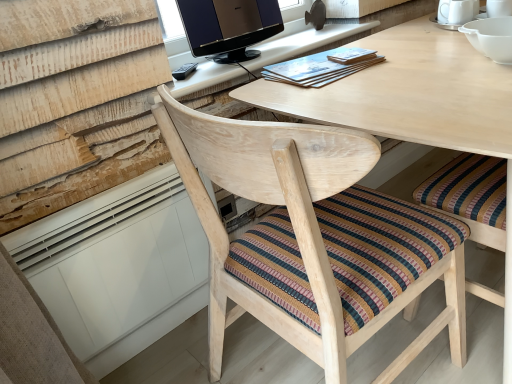
At what (x,y) coordinates should I click in order to perform the action: click on light wood computer desk at upper center. Please return your answer as a coordinate pair (x, y). Looking at the image, I should click on (303, 43).

This screenshot has width=512, height=384. What do you see at coordinates (314, 238) in the screenshot? I see `natural wood chair at center` at bounding box center [314, 238].

Describe the element at coordinates (318, 68) in the screenshot. This screenshot has height=384, width=512. I see `matte wooden book at upper center, the 1th book when ordered from left to right` at that location.

You are a GUI agent. You are given a task and a screenshot of the screen. Output one action in this format:
    pyautogui.click(x=<x>, y=<y>)
    Task: Click on the satin black monitor at upper center
    Image resolution: width=512 pixels, height=384 pixels.
    Given the screenshot: What is the action you would take?
    pyautogui.click(x=229, y=27)

Describe the element at coordinates (351, 55) in the screenshot. The image size is (512, 384). I see `matte brown book at upper center, the first book positioned from the right` at that location.

Image resolution: width=512 pixels, height=384 pixels. In order to click on light wood computer desk at upper center in this screenshot , I will do `click(303, 43)`.

Measure the distance between matte wooden book at upper center, the 1th book when ordered from left to right, and matte brown book at upper center, the 2th book from the left.

matte wooden book at upper center, the 1th book when ordered from left to right, is 3.50 inches away from matte brown book at upper center, the 2th book from the left.

What's the angular difference between matte wooden book at upper center, the 2th book in the right-to-left sequence, and matte brown book at upper center, the 2th book from the left,'s facing directions?

The angle between the facing direction of matte wooden book at upper center, the 2th book in the right-to-left sequence, and the facing direction of matte brown book at upper center, the 2th book from the left, is 1.3 degrees.

Who is smaller, matte wooden book at upper center, the 2th book in the right-to-left sequence, or matte brown book at upper center, the first book positioned from the right?

Smaller between the two is matte brown book at upper center, the first book positioned from the right.

Locate an element on the screen. Image resolution: width=512 pixels, height=384 pixels. book behind the matte wooden book at upper center, the 1th book when ordered from left to right is located at coordinates (351, 55).

Is light wood computer desk at upper center surrounding matte brown book at upper center, the 2th book from the left?

Definitely not — matte brown book at upper center, the 2th book from the left, is not inside light wood computer desk at upper center.

Is matte brown book at upper center, the first book positioned from the right, at the back of light wood computer desk at upper center?

light wood computer desk at upper center does not have its back to matte brown book at upper center, the first book positioned from the right.

Is light wood computer desk at upper center not near matte brown book at upper center, the first book positioned from the right?

That's not correct — light wood computer desk at upper center is a little close to matte brown book at upper center, the first book positioned from the right.

You are a GUI agent. You are given a task and a screenshot of the screen. Output one action in this format:
    pyautogui.click(x=<x>, y=<y>)
    Task: Click on the 2nd book located above the light wood computer desk at upper center (from a real-world perspective)
    The height and width of the screenshot is (384, 512).
    Given the screenshot: What is the action you would take?
    pyautogui.click(x=351, y=55)

Would you say light wood computer desk at upper center is a long distance from natural wood chair at center?

That's not correct — light wood computer desk at upper center is a little close to natural wood chair at center.

From a real-world perspective, who is located lower, light wood computer desk at upper center or natural wood chair at center?

In real-world perspective, natural wood chair at center is lower.

From the picture: How different are the orientations of light wood computer desk at upper center and natural wood chair at center in degrees?

The angular difference between light wood computer desk at upper center and natural wood chair at center is 88.5 degrees.

Is the position of light wood computer desk at upper center more distant than that of natural wood chair at center?

Yes, the depth of light wood computer desk at upper center is greater than that of natural wood chair at center.

From the image's perspective, is light wood computer desk at upper center on top of satin black monitor at upper center?

No, from the image's perspective, light wood computer desk at upper center is not over satin black monitor at upper center.

Which of these two, light wood computer desk at upper center or satin black monitor at upper center, is bigger?

Bigger between the two is light wood computer desk at upper center.

Considering the sizes of objects light wood computer desk at upper center and satin black monitor at upper center in the image provided, who is wider, light wood computer desk at upper center or satin black monitor at upper center?

light wood computer desk at upper center.

Which is closer, (340,26) or (275,21)?

Point (340,26).

Which object is thinner, satin black monitor at upper center or matte wooden book at upper center, the 2th book in the right-to-left sequence?

satin black monitor at upper center is thinner.

Can you confirm if satin black monitor at upper center is smaller than matte wooden book at upper center, the 2th book in the right-to-left sequence?

No, satin black monitor at upper center is not smaller than matte wooden book at upper center, the 2th book in the right-to-left sequence.

How many degrees apart are the facing directions of satin black monitor at upper center and matte wooden book at upper center, the 1th book when ordered from left to right?

The facing directions of satin black monitor at upper center and matte wooden book at upper center, the 1th book when ordered from left to right, are 9.13 degrees apart.

The image size is (512, 384). Find the location of `television above the matte wooden book at upper center, the 1th book when ordered from left to right (from the image's perspective)`. television above the matte wooden book at upper center, the 1th book when ordered from left to right (from the image's perspective) is located at coordinates (229, 27).

Considering the positions of points (330, 56) and (311, 63), is point (330, 56) farther from camera compared to point (311, 63)?

Yes, it is behind point (311, 63).

From the image's perspective, relative to matte wooden book at upper center, the 1th book when ordered from left to right, is matte brown book at upper center, the first book positioned from the right, above or below?

matte brown book at upper center, the first book positioned from the right, is situated higher than matte wooden book at upper center, the 1th book when ordered from left to right, in the image.

Could you tell me if matte brown book at upper center, the first book positioned from the right, is facing matte wooden book at upper center, the 1th book when ordered from left to right?

No, matte brown book at upper center, the first book positioned from the right, does not turn towards matte wooden book at upper center, the 1th book when ordered from left to right.

Can you confirm if matte brown book at upper center, the 2th book from the left, is positioned to the right of matte wooden book at upper center, the 1th book when ordered from left to right?

Yes.

Between matte wooden book at upper center, the 2th book in the right-to-left sequence, and satin black monitor at upper center, which one has less height?

matte wooden book at upper center, the 2th book in the right-to-left sequence.

From the image's perspective, is matte wooden book at upper center, the 1th book when ordered from left to right, under satin black monitor at upper center?

Yes, from the image's perspective, matte wooden book at upper center, the 1th book when ordered from left to right, is beneath satin black monitor at upper center.

Which of these two, matte wooden book at upper center, the 2th book in the right-to-left sequence, or satin black monitor at upper center, is smaller?

With smaller size is matte wooden book at upper center, the 2th book in the right-to-left sequence.

Identify the location of book below the matte brown book at upper center, the 2th book from the left (from a real-world perspective). (318, 68).

I want to click on book behind the light wood computer desk at upper center, so click(x=351, y=55).

From the image, which object appears to be farther from satin black monitor at upper center, light wood computer desk at upper center or matte wooden book at upper center, the 2th book in the right-to-left sequence?

matte wooden book at upper center, the 2th book in the right-to-left sequence, is positioned further to the anchor satin black monitor at upper center.

Looking at the image, which one is located further to light wood computer desk at upper center, matte brown book at upper center, the first book positioned from the right, or matte wooden book at upper center, the 2th book in the right-to-left sequence?

matte brown book at upper center, the first book positioned from the right, is further to light wood computer desk at upper center.

Looking at the image, which one is located closer to light wood computer desk at upper center, matte wooden book at upper center, the 2th book in the right-to-left sequence, or satin black monitor at upper center?

The object closer to light wood computer desk at upper center is satin black monitor at upper center.

From the image, which object appears to be nearer to satin black monitor at upper center, light wood computer desk at upper center or natural wood chair at center?

Among the two, light wood computer desk at upper center is located nearer to satin black monitor at upper center.

Considering their positions, is satin black monitor at upper center positioned closer to natural wood chair at center than light wood computer desk at upper center?

The object closer to natural wood chair at center is light wood computer desk at upper center.

From the image, which object appears to be farther from matte wooden book at upper center, the 1th book when ordered from left to right, light wood computer desk at upper center or natural wood chair at center?

natural wood chair at center.

Based on their spatial positions, is matte brown book at upper center, the 2th book from the left, or matte wooden book at upper center, the 1th book when ordered from left to right, further from satin black monitor at upper center?

matte brown book at upper center, the 2th book from the left, lies further to satin black monitor at upper center than the other object.

Based on the photo, based on their spatial positions, is natural wood chair at center or satin black monitor at upper center closer to matte brown book at upper center, the first book positioned from the right?

satin black monitor at upper center.

Where is `book positioned between natural wood chair at center and light wood computer desk at upper center from near to far`? The width and height of the screenshot is (512, 384). book positioned between natural wood chair at center and light wood computer desk at upper center from near to far is located at coordinates (318, 68).

Find the location of a particular element. book between satin black monitor at upper center and matte brown book at upper center, the 2th book from the left, from left to right is located at coordinates (318, 68).

Identify the location of computer desk between natural wood chair at center and matte brown book at upper center, the 2th book from the left, from front to back. (303, 43).

What are the coordinates of `book between natural wood chair at center and matte brown book at upper center, the first book positioned from the right, along the z-axis` in the screenshot? It's located at (318, 68).